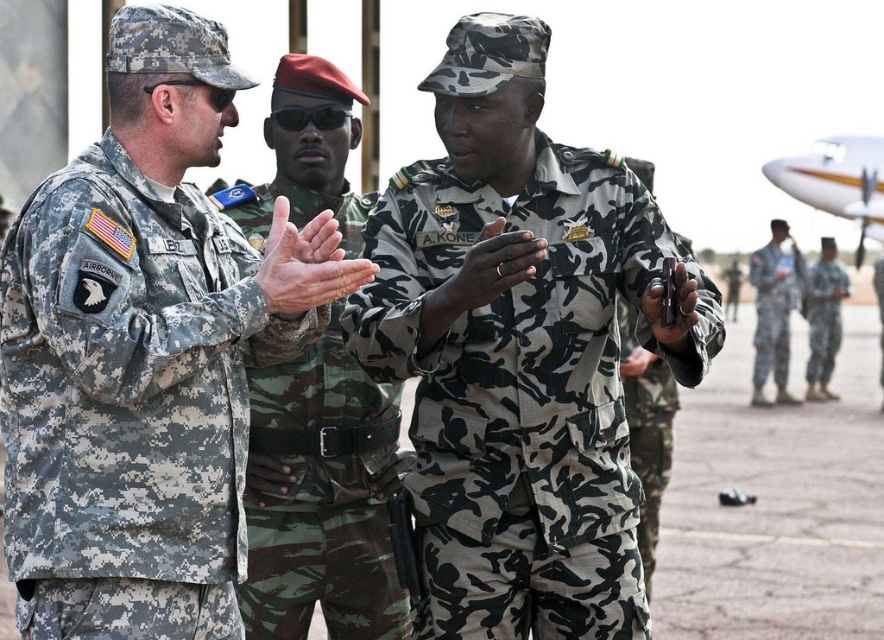
Question: From the image, what is the correct spatial relationship of digital camouflage uniform at left in relation to camouflage uniform at center?

Choices:
 (A) right
 (B) left

Answer: (B)

Question: Which object appears farthest from the camera in this image?

Choices:
 (A) digital camouflage uniform at left
 (B) black matte sunglasses at center

Answer: (B)

Question: Can you confirm if camouflage uniform at center is positioned to the right of camouflage fabric uniform at right?

Choices:
 (A) no
 (B) yes

Answer: (A)

Question: Is digital camouflage uniform at left to the left of black matte sunglasses at center from the viewer's perspective?

Choices:
 (A) yes
 (B) no

Answer: (A)

Question: Which is nearer to the camouflage fabric uniform at right?

Choices:
 (A) camouflage uniform at center
 (B) black matte sunglasses at center
 (C) digital camouflage uniform at left

Answer: (B)

Question: Which of these objects is positioned closest to the camouflage fabric uniform at right?

Choices:
 (A) camouflage fabric uniform at center
 (B) camouflage uniform at center

Answer: (B)